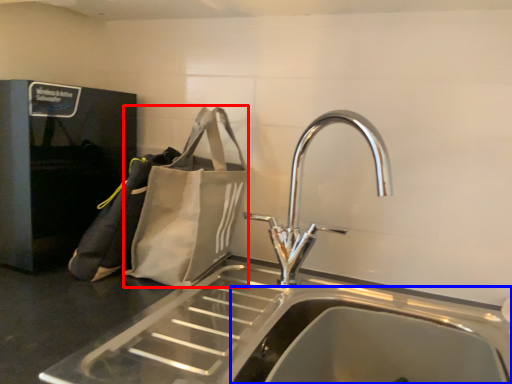
Question: Which point is closer to the camera, pouch (highlighted by a red box) or sink (highlighted by a blue box)?

Choices:
 (A) pouch
 (B) sink

Answer: (B)